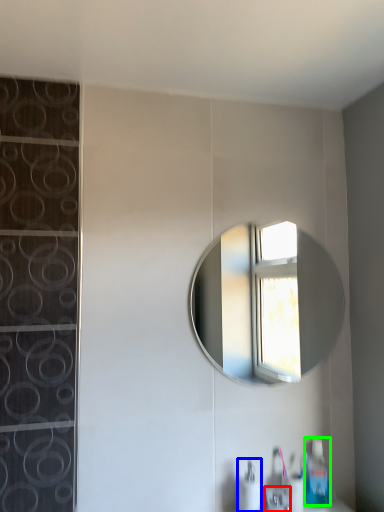
Question: Considering the real-world distances, which object is farthest from faucet (highlighted by a red box)? soap dispenser (highlighted by a blue box) or soap dispenser (highlighted by a green box)?

Choices:
 (A) soap dispenser
 (B) soap dispenser

Answer: (B)